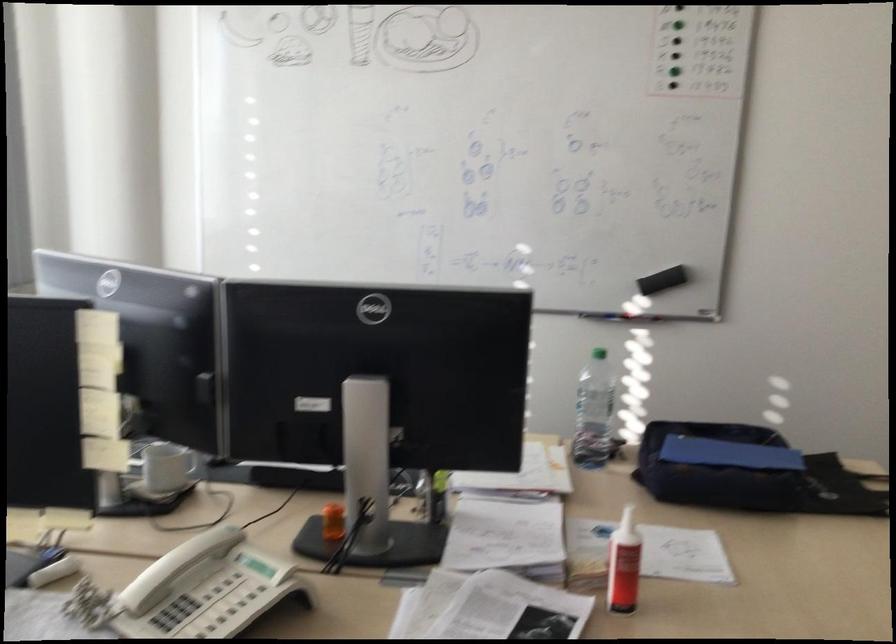
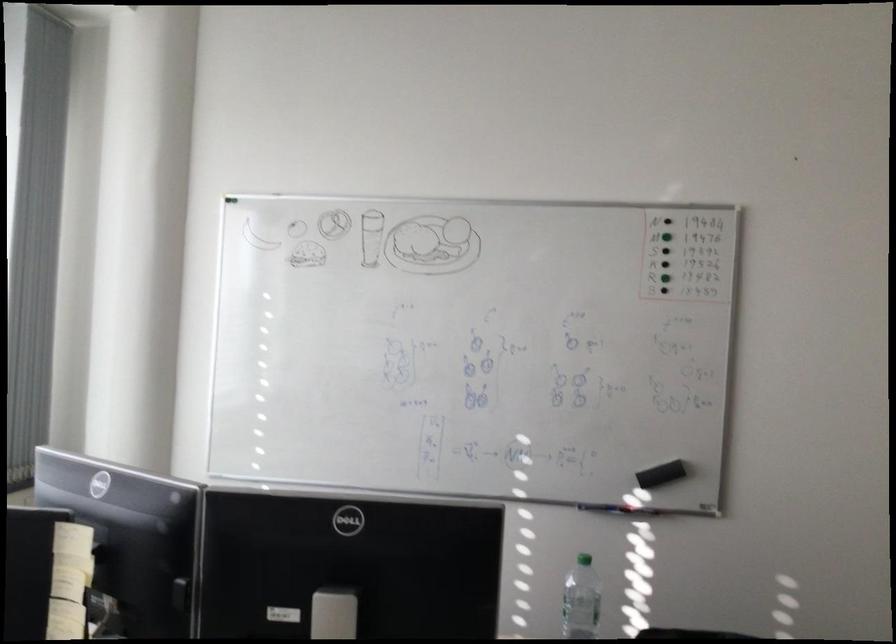
Locate, in the second image, the point that corresponds to [660,279] in the first image.

(661, 474)